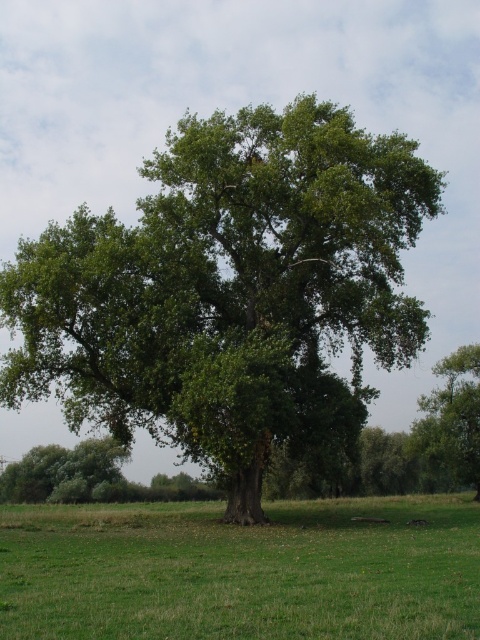
You are a gardener who wants to plant a new flower bed between the green grass at center and the green leafy tree at center. Considering their heights, which one should you place the flowers closer to?

You should place the flowers closer to the green grass at center because it is shorter than the green leafy tree at center, reducing the risk of the flowers being overshadowed.

You are standing at the center of the grassy field and want to place a small garden bench. The bench requires a clear space of 1.2 meters in diameter. Is there enough space at the green grass at center to accommodate it?

The green grass at center is located at point (241,572), but the description does not provide information about the size or available space there. Therefore, it is uncertain if the bench will fit.

You are standing in the grassy field and see both the green leafy oak tree at center and the green leafy tree at center. Which tree is positioned higher in the image?

The green leafy oak tree at center is positioned higher than the green leafy tree at center in the image.